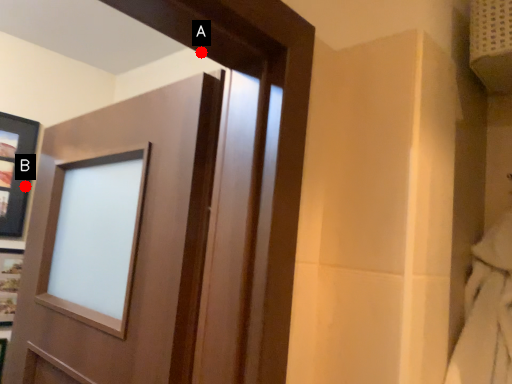
Question: Two points are circled on the image, labeled by A and B beside each circle. Which point appears farthest from the camera in this image?

Choices:
 (A) A is further
 (B) B is further

Answer: (B)